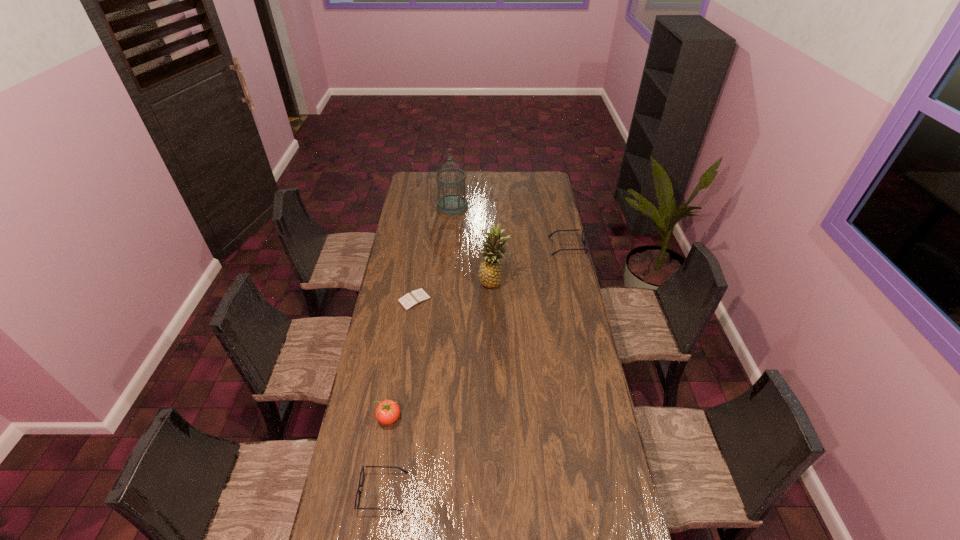
The image size is (960, 540). In the image, there is a desktop. What are the coordinates of `vacant space at the near edge` in the screenshot? It's located at (541, 525).

This screenshot has height=540, width=960. What are the coordinates of `vacant space at the left edge` in the screenshot? It's located at (338, 500).

This screenshot has width=960, height=540. I want to click on free space at the right edge of the desktop, so click(x=556, y=244).

In the image, there is a desktop. Where is `vacant space at the far left corner`? The height and width of the screenshot is (540, 960). vacant space at the far left corner is located at coordinates (433, 180).

In the image, there is a desktop. Find the location of `free space at the far right corner`. free space at the far right corner is located at coordinates (538, 185).

Find the location of a particular element. vacant space in between the shortest object and the pineapple is located at coordinates (454, 291).

Find the location of `unoccupied area between the birdcage and the fourth shortest object`. unoccupied area between the birdcage and the fourth shortest object is located at coordinates (420, 312).

Image resolution: width=960 pixels, height=540 pixels. What are the coordinates of `empty space that is in between the pineapple and the rightmost object` in the screenshot? It's located at (530, 264).

This screenshot has width=960, height=540. What are the coordinates of `free spot between the taller spectacles and the shorter spectacles` in the screenshot? It's located at (475, 369).

Where is `vacant area between the second object from right to left and the third shortest object`? Image resolution: width=960 pixels, height=540 pixels. vacant area between the second object from right to left and the third shortest object is located at coordinates (530, 264).